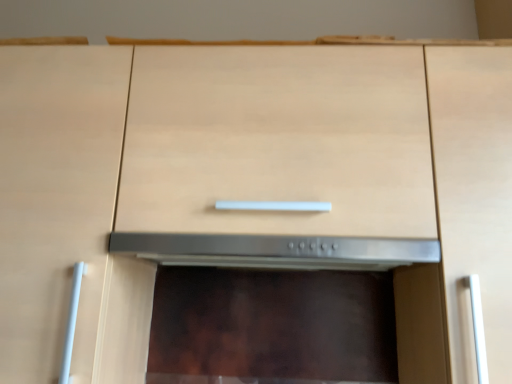
What do you see at coordinates (276, 251) in the screenshot? I see `satin silver vent at center` at bounding box center [276, 251].

Identify the location of satin silver vent at center. (276, 251).

Measure the distance between satin silver vent at center and camera.

satin silver vent at center is 30.34 inches from camera.

Locate an element on the screen. The image size is (512, 384). satin silver vent at center is located at coordinates (276, 251).